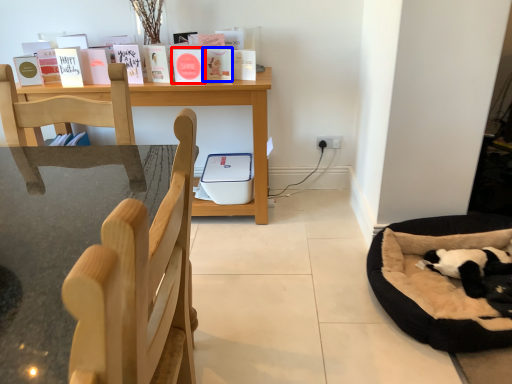
Question: Which object is further to the camera taking this photo, paperback book (highlighted by a red box) or paperback book (highlighted by a blue box)?

Choices:
 (A) paperback book
 (B) paperback book

Answer: (B)